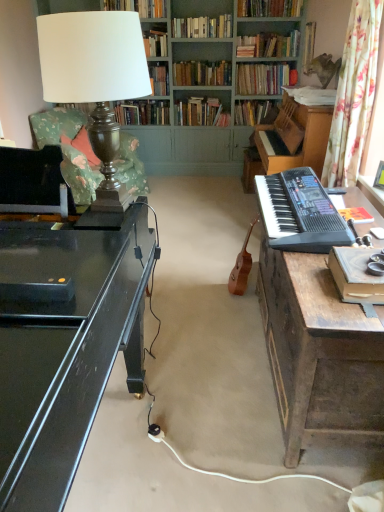
Question: Could you tell me if hardcover books at center, the 11th book in the front-to-back sequence, is facing hardcover book at center, which appears as the 3th book when viewed from the back?

Choices:
 (A) yes
 (B) no

Answer: (B)

Question: From the image's perspective, is hardcover books at center, the 11th book in the front-to-back sequence, above hardcover book at center, which appears as the 3th book when viewed from the back?

Choices:
 (A) yes
 (B) no

Answer: (A)

Question: Can you confirm if hardcover books at center, the 11th book in the front-to-back sequence, is taller than hardcover book at center, which is the tenth book from front to back?

Choices:
 (A) yes
 (B) no

Answer: (A)

Question: Is there a large distance between hardcover books at center, the 11th book in the front-to-back sequence, and hardcover book at center, which appears as the 3th book when viewed from the back?

Choices:
 (A) no
 (B) yes

Answer: (A)

Question: Is hardcover book at center, which appears as the 3th book when viewed from the back, inside hardcover books at center, the 11th book in the front-to-back sequence?

Choices:
 (A) yes
 (B) no

Answer: (B)

Question: Does hardcover books at center, the second book in the back-to-front sequence, appear on the right side of hardcover book at center, which appears as the 3th book when viewed from the back?

Choices:
 (A) yes
 (B) no

Answer: (B)

Question: Considering the relative positions of hardcover books at center, the 11th book in the front-to-back sequence, and metallic lampshade at left in the image provided, is hardcover books at center, the 11th book in the front-to-back sequence, to the left of metallic lampshade at left from the viewer's perspective?

Choices:
 (A) yes
 (B) no

Answer: (B)

Question: Considering the relative sizes of hardcover books at center, the second book in the back-to-front sequence, and metallic lampshade at left in the image provided, is hardcover books at center, the second book in the back-to-front sequence, wider than metallic lampshade at left?

Choices:
 (A) yes
 (B) no

Answer: (A)

Question: Could you tell me if hardcover books at center, the 11th book in the front-to-back sequence, is turned towards metallic lampshade at left?

Choices:
 (A) yes
 (B) no

Answer: (A)

Question: Can metallic lampshade at left be found inside hardcover books at center, the second book in the back-to-front sequence?

Choices:
 (A) no
 (B) yes

Answer: (A)

Question: From the image's perspective, is hardcover books at center, the second book in the back-to-front sequence, located beneath metallic lampshade at left?

Choices:
 (A) yes
 (B) no

Answer: (B)

Question: Does hardcover books at center, the second book in the back-to-front sequence, have a smaller size compared to metallic lampshade at left?

Choices:
 (A) yes
 (B) no

Answer: (A)

Question: From the image's perspective, is floral fabric swivel chair at left under hardcover book at upper center, the eighth book viewed from the front?

Choices:
 (A) yes
 (B) no

Answer: (A)